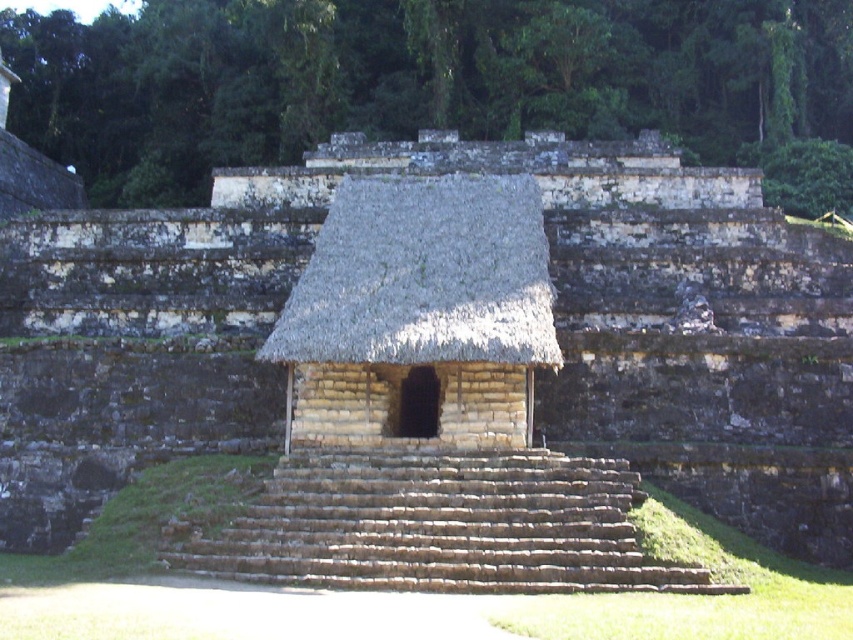
Measure the distance between thatched straw hut at center and camera.

A distance of 151.70 feet exists between thatched straw hut at center and camera.

Is point (451, 381) farther from viewer compared to point (486, 524)?

Yes, point (451, 381) is farther from viewer.

Between point (480, 328) and point (459, 470), which one is positioned behind?

The point (480, 328) is more distant.

Image resolution: width=853 pixels, height=640 pixels. In order to click on thatched straw hut at center in this screenshot , I will do `click(421, 307)`.

Is stone amphitheater at center thinner than brown stone stairs at center?

Incorrect, stone amphitheater at center's width is not less than brown stone stairs at center's.

Between stone amphitheater at center and brown stone stairs at center, which one appears on the left side from the viewer's perspective?

stone amphitheater at center is more to the left.

Does point (677, 337) come in front of point (213, 563)?

No, it is behind (213, 563).

You are a GUI agent. You are given a task and a screenshot of the screen. Output one action in this format:
    pyautogui.click(x=<x>, y=<y>)
    Task: Click on the stone amphitheater at center
    The height and width of the screenshot is (640, 853).
    Given the screenshot: What is the action you would take?
    (537, 371)

Does stone amphitheater at center appear on the right side of thatched straw hut at center?

No, stone amphitheater at center is not to the right of thatched straw hut at center.

Can you confirm if stone amphitheater at center is taller than thatched straw hut at center?

Indeed, stone amphitheater at center has a greater height compared to thatched straw hut at center.

Does point (20, 502) come farther from viewer compared to point (409, 221)?

No, it is in front of (409, 221).

Identify the location of stone amphitheater at center. (537, 371).